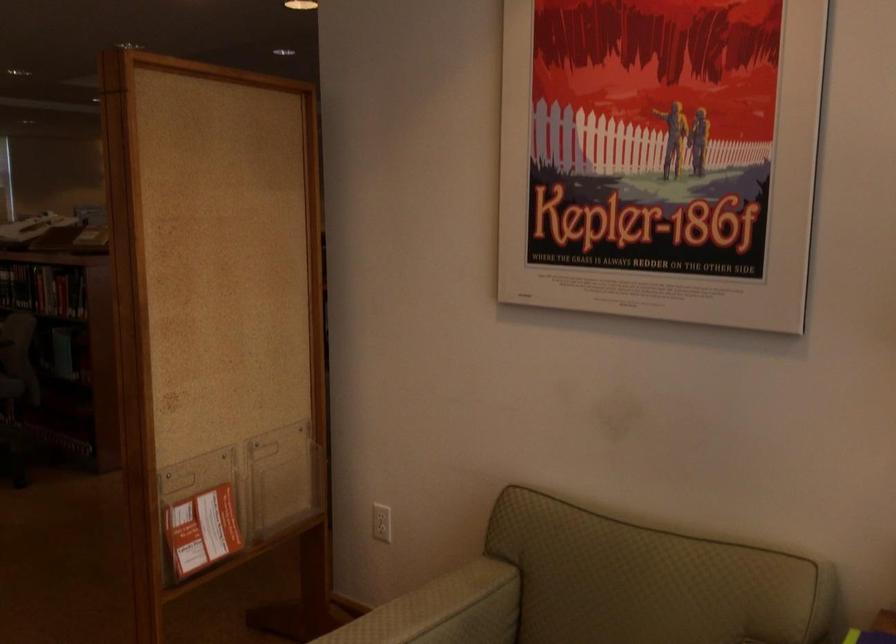
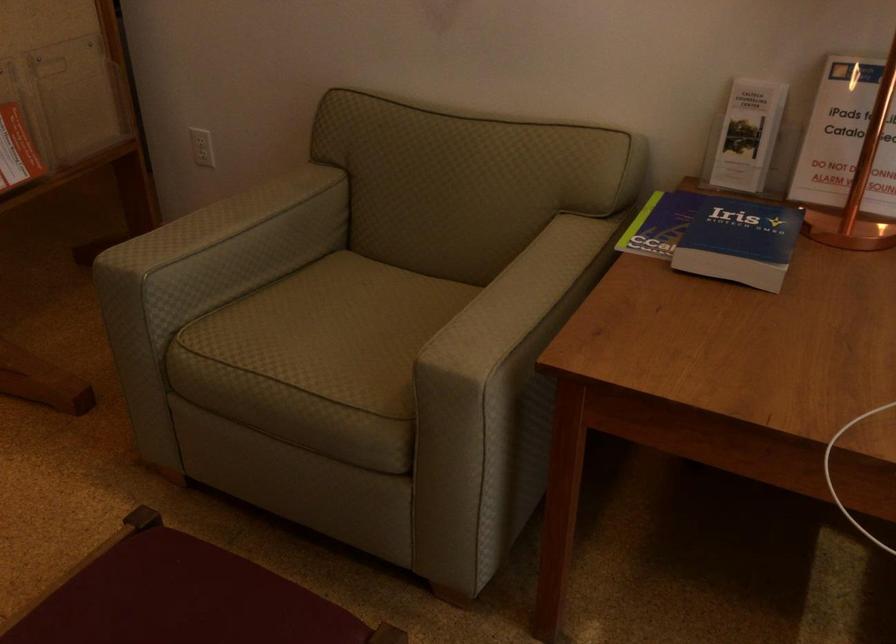
Locate, in the second image, the point that corresponds to the point at 385,521 in the first image.

(202, 147)